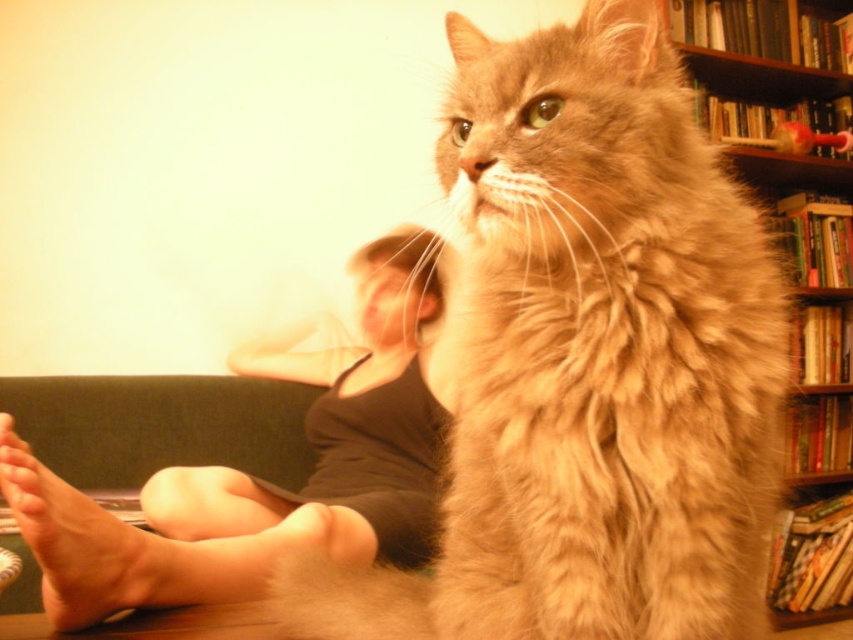
Is smooth skin legs at lower left taller than dark green fabric couch at lower left?

Indeed, smooth skin legs at lower left has a greater height compared to dark green fabric couch at lower left.

Is point (363, 353) more distant than point (219, 461)?

Yes, point (363, 353) is farther from viewer.

Where is `smooth skin legs at lower left`? The image size is (853, 640). smooth skin legs at lower left is located at coordinates (259, 481).

In the scene shown: Can you confirm if fuzzy brown cat at upper right is positioned above skinny flesh-toned foot at lower left?

Indeed, fuzzy brown cat at upper right is positioned over skinny flesh-toned foot at lower left.

Does fuzzy brown cat at upper right have a smaller size compared to skinny flesh-toned foot at lower left?

Actually, fuzzy brown cat at upper right might be larger than skinny flesh-toned foot at lower left.

Who is more forward, [700,596] or [45,600]?

Point [700,596] is in front.

What are the coordinates of `fuzzy brown cat at upper right` in the screenshot? It's located at (589, 362).

Does dark green fabric couch at lower left lie in front of skinny flesh-toned foot at lower left?

No, it is not.

Who is more forward, (x=296, y=422) or (x=49, y=497)?

Positioned in front is point (x=49, y=497).

Is point (178, 460) positioned in front of point (47, 595)?

That is False.

Where is `dark green fabric couch at lower left`? This screenshot has height=640, width=853. dark green fabric couch at lower left is located at coordinates (161, 426).